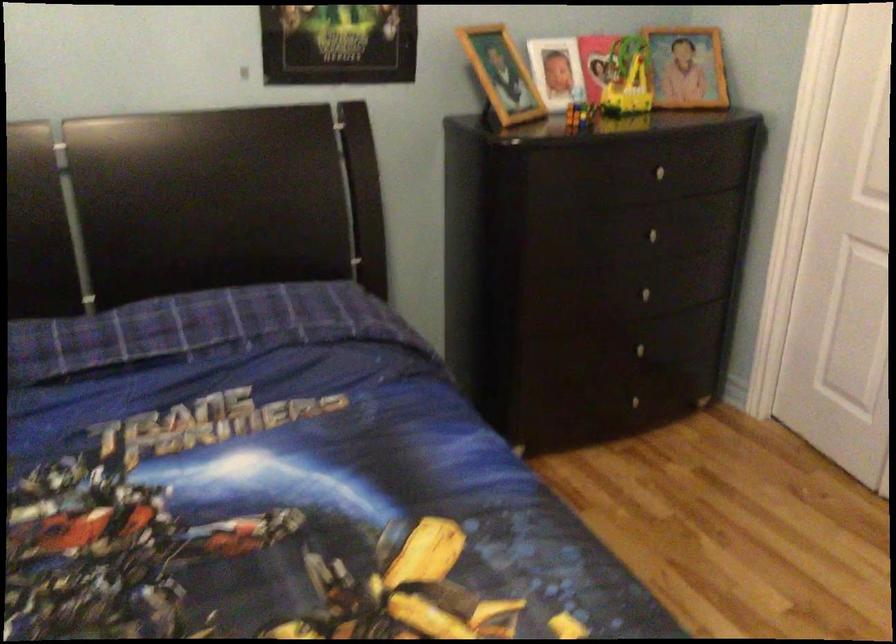
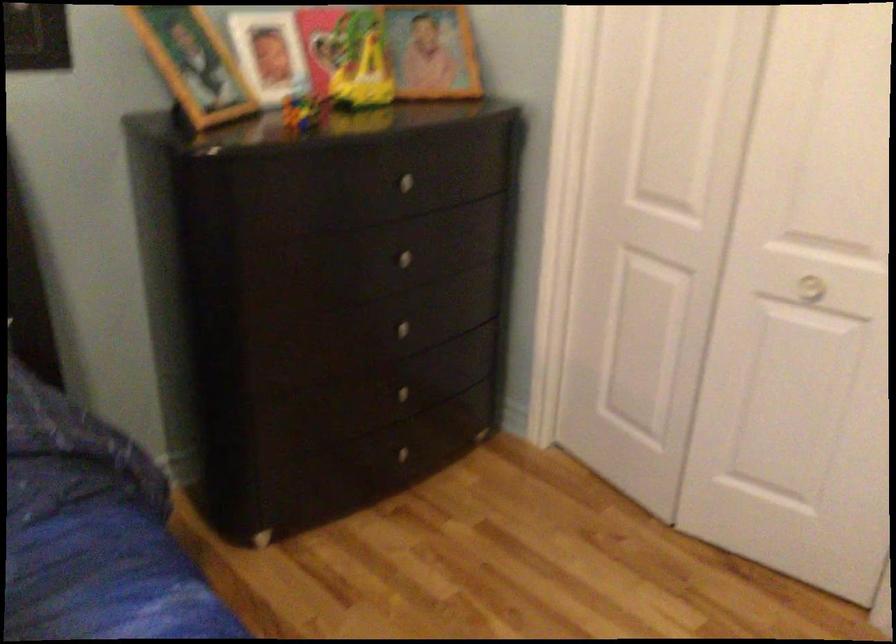
In the second image, find the point that corresponds to [636,348] in the first image.

(400, 393)